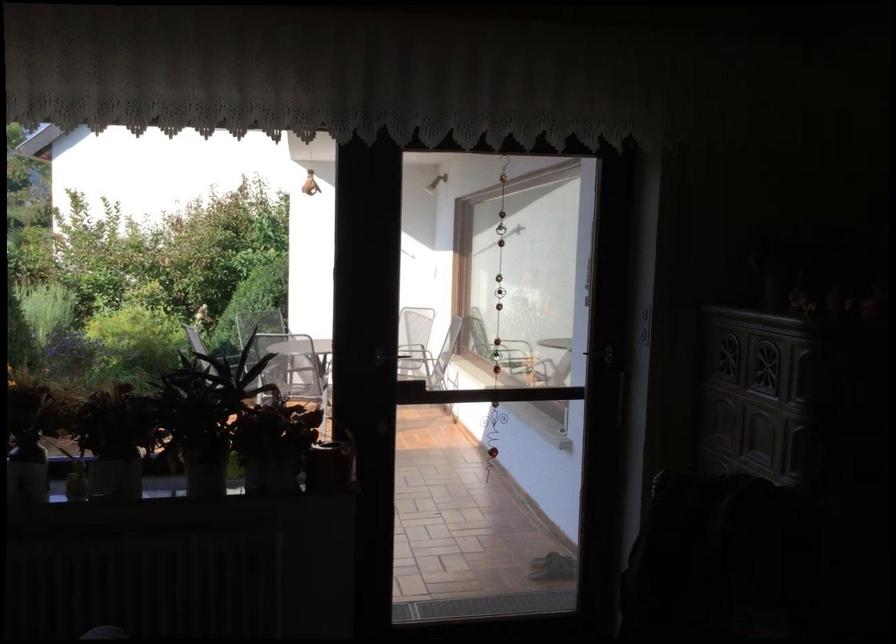
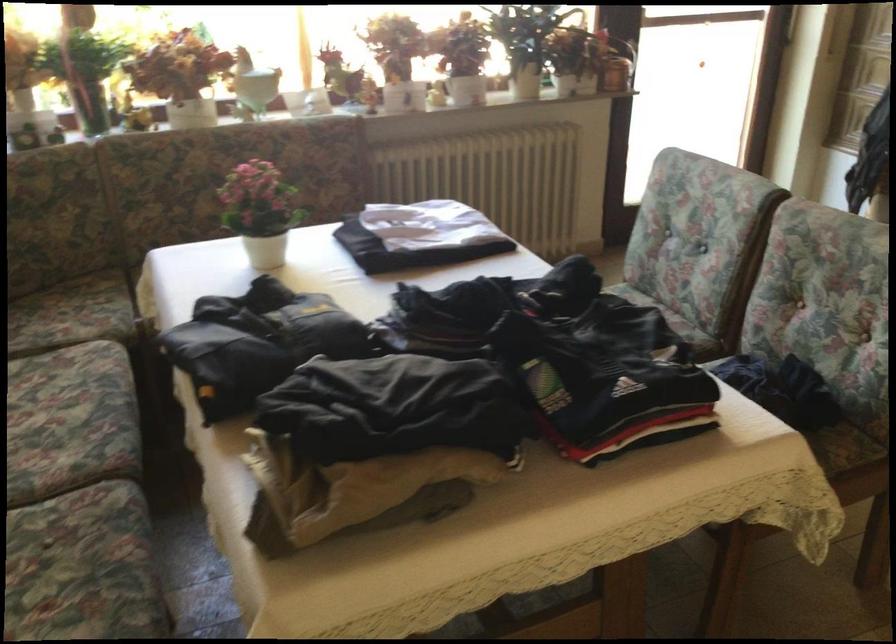
The images are taken continuously from a first-person perspective. In which direction are you moving?

The movement direction of the cameraman is left, backward.